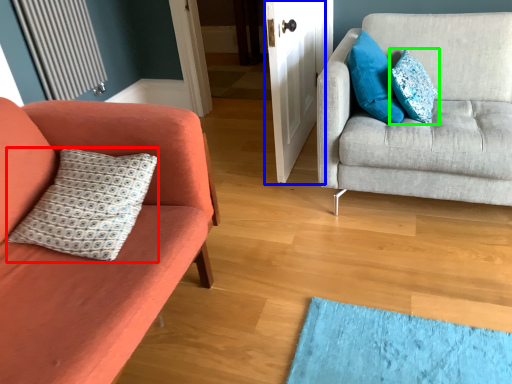
Question: Which is nearer to the pillow (highlighted by a red box)? door (highlighted by a blue box) or pillow (highlighted by a green box).

Choices:
 (A) door
 (B) pillow

Answer: (A)